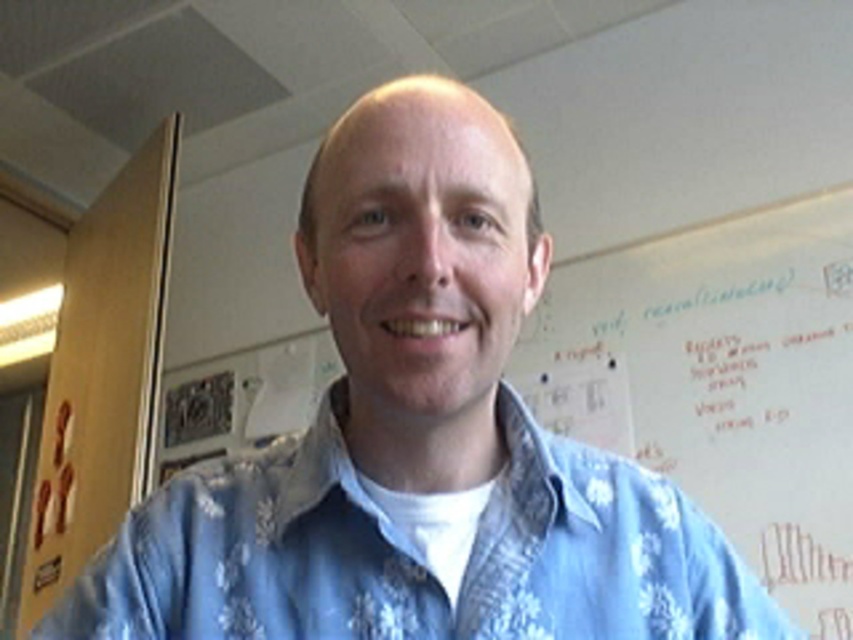
You are a student entering the classroom and see the blue floral shirt at center and the white paper at upper center. Which object is closer to the left side of the room?

The blue floral shirt at center is closer to the left side of the room because it is positioned to the left of the white paper at upper center.

You are a student in the classroom and want to know which object is shorter between the blue floral shirt at center and the white paper at upper center. Can you tell me?

The blue floral shirt at center has a lesser height compared to the white paper at upper center, so the blue floral shirt at center is shorter.